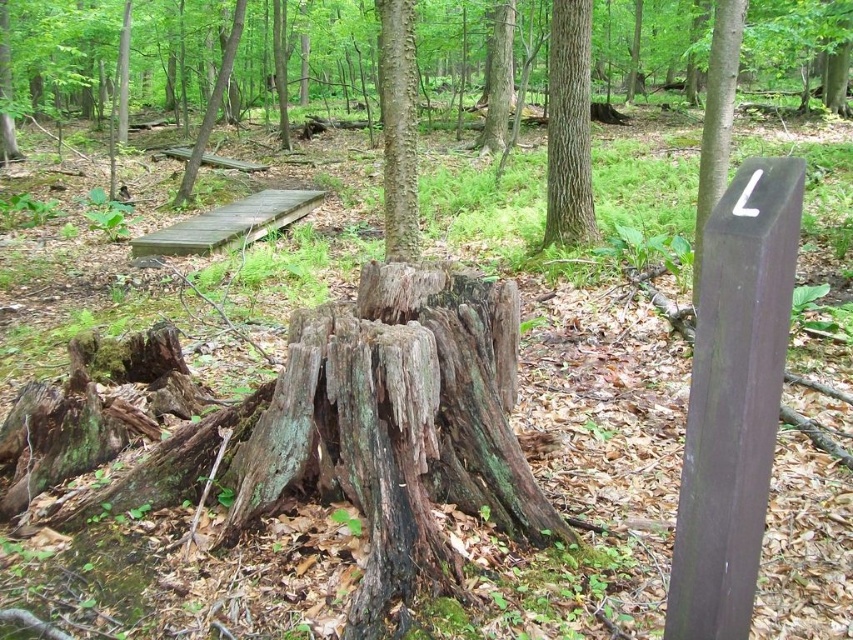
Question: Is the position of rough bark tree trunk at center more distant than that of brown rough wood post at upper right?

Choices:
 (A) no
 (B) yes

Answer: (A)

Question: Which of the following is the closest to the observer?

Choices:
 (A) brown wooden plank at upper left
 (B) rough bark tree trunk at center

Answer: (B)

Question: Among these objects, which one is farthest from the camera?

Choices:
 (A) smooth brown tree trunk at upper center
 (B) green mossy stump at upper center
 (C) rough bark tree trunk at center

Answer: (B)

Question: Is brown rough wood post at upper right further to camera compared to green mossy stump at upper center?

Choices:
 (A) no
 (B) yes

Answer: (A)

Question: Which of the following is the farthest from the observer?

Choices:
 (A) brown wooden plank at upper left
 (B) smooth brown tree trunk at upper center
 (C) brown rough wood post at upper right

Answer: (A)

Question: Can you confirm if smooth brown tree trunk at upper center is positioned to the right of brown wooden plank at upper left?

Choices:
 (A) yes
 (B) no

Answer: (A)